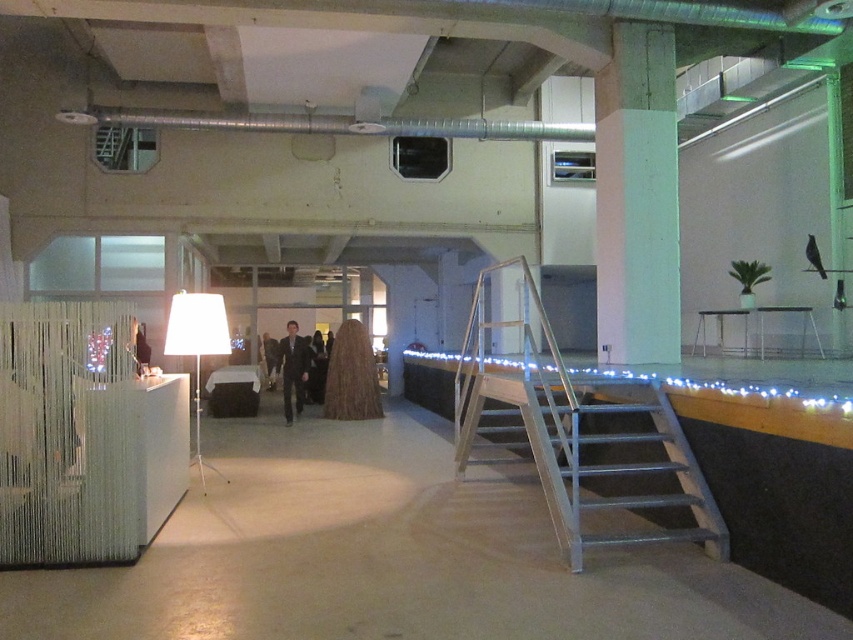
Is point (216, 468) more distant than point (308, 364)?

That is False.

Which of these two, white fabric lamp at center or dark gray suit at center, stands shorter?

With less height is dark gray suit at center.

I want to click on white fabric lamp at center, so click(x=196, y=346).

Find the location of a particular element. Image resolution: width=853 pixels, height=640 pixels. white fabric lamp at center is located at coordinates (196, 346).

At what (x,y) coordinates should I click in order to perform the action: click on green concrete pillar at upper right. Please return your answer as a coordinate pair (x, y). Looking at the image, I should click on (636, 198).

Can you confirm if green concrete pillar at upper right is bigger than matte black suit at center?

Indeed, green concrete pillar at upper right has a larger size compared to matte black suit at center.

This screenshot has height=640, width=853. Describe the element at coordinates (636, 198) in the screenshot. I see `green concrete pillar at upper right` at that location.

Where is `green concrete pillar at upper right`? green concrete pillar at upper right is located at coordinates (636, 198).

Is metallic gray stairs at center wider than white fabric lamp at center?

Incorrect, metallic gray stairs at center's width does not surpass white fabric lamp at center's.

Can you confirm if metallic gray stairs at center is taller than white fabric lamp at center?

No.

Find the location of a particular element. Image resolution: width=853 pixels, height=640 pixels. metallic gray stairs at center is located at coordinates (598, 456).

This screenshot has height=640, width=853. I want to click on metallic gray stairs at center, so click(598, 456).